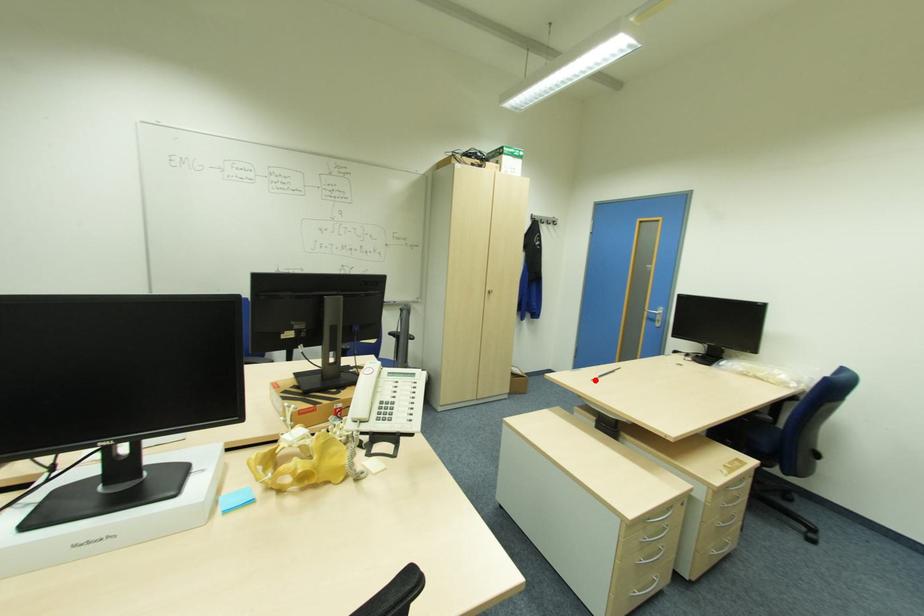
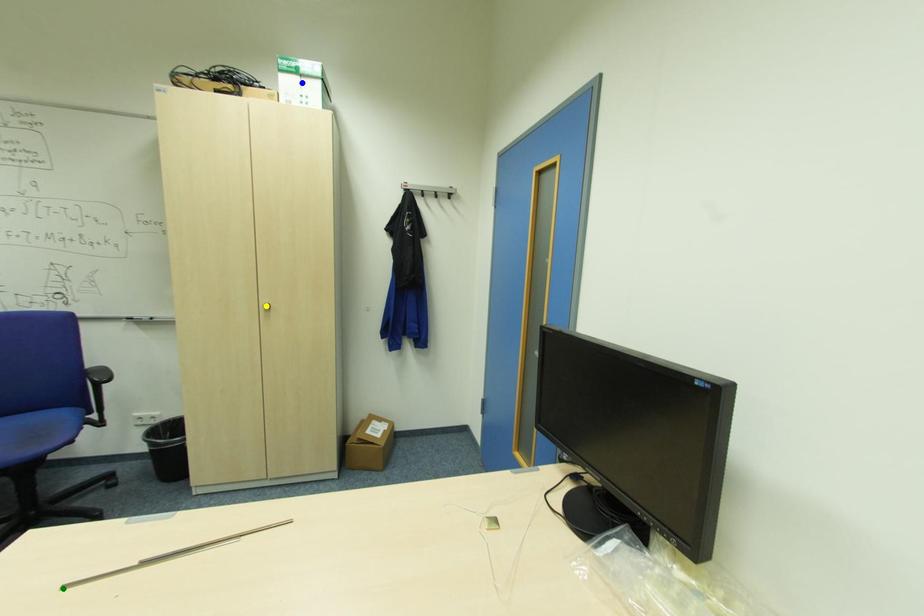
Question: I am providing you with two images of the same scene from different viewpoints. A red point is marked on the first image. You are given multiple points on the second image. In image 2, which mark is for the same physical point as the one in image 1?

Choices:
 (A) blue point
 (B) green point
 (C) yellow point

Answer: (B)